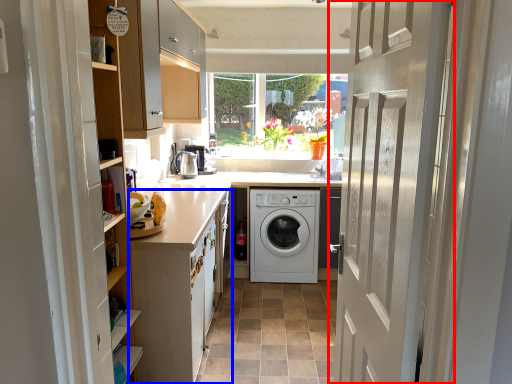
Question: Which object appears farthest to the camera in this image, door (highlighted by a red box) or cabinetry (highlighted by a blue box)?

Choices:
 (A) door
 (B) cabinetry

Answer: (B)